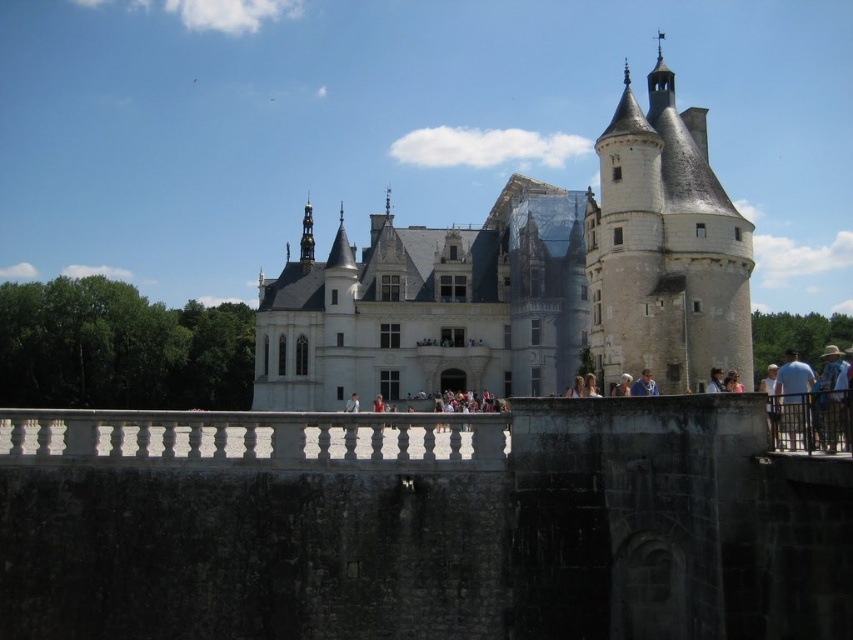
Which is in front, point (709, 376) or point (729, 388)?

Point (729, 388) is in front.

Is white fabric hat at upper center above brown leather hat at upper right?

Yes.

Where is `white fabric hat at upper center`? The image size is (853, 640). white fabric hat at upper center is located at coordinates (714, 380).

Can you confirm if brown fabric hat at upper right is positioned above white fabric hat at upper center?

Incorrect, brown fabric hat at upper right is not positioned above white fabric hat at upper center.

Does point (833, 401) come in front of point (720, 372)?

Yes, it is.

Between point (827, 394) and point (712, 388), which one is positioned behind?

The point (712, 388) is behind.

You are a GUI agent. You are given a task and a screenshot of the screen. Output one action in this format:
    pyautogui.click(x=<x>, y=<y>)
    Task: Click on the brown fabric hat at upper right
    
    Given the screenshot: What is the action you would take?
    pyautogui.click(x=831, y=394)

Which is more to the left, white stone castle at center or blue shirt at upper right?

white stone castle at center is more to the left.

Does point (341, 387) come farther from viewer compared to point (801, 392)?

Yes, it is.

Which is in front, point (721, 342) or point (804, 445)?

Positioned in front is point (804, 445).

Where is `white stone castle at center`? white stone castle at center is located at coordinates (527, 282).